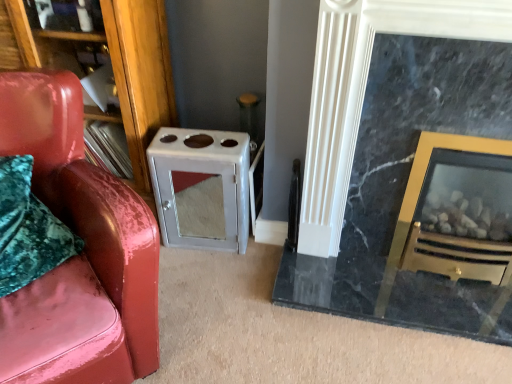
Question: Is glossy leather chair at left surrounding wooden bookshelf at left?

Choices:
 (A) yes
 (B) no

Answer: (B)

Question: From a real-world perspective, is glossy leather chair at left positioned under wooden bookshelf at left based on gravity?

Choices:
 (A) yes
 (B) no

Answer: (A)

Question: Is glossy leather chair at left to the left of wooden bookshelf at left from the viewer's perspective?

Choices:
 (A) yes
 (B) no

Answer: (B)

Question: From the image's perspective, is glossy leather chair at left located above wooden bookshelf at left?

Choices:
 (A) no
 (B) yes

Answer: (A)

Question: Does glossy leather chair at left have a lesser width compared to wooden bookshelf at left?

Choices:
 (A) no
 (B) yes

Answer: (A)

Question: Does glossy leather chair at left touch wooden bookshelf at left?

Choices:
 (A) yes
 (B) no

Answer: (B)

Question: Is the depth of wooden bookshelf at left less than that of black marble fireplace at right?

Choices:
 (A) no
 (B) yes

Answer: (A)

Question: Would you consider wooden bookshelf at left to be distant from black marble fireplace at right?

Choices:
 (A) no
 (B) yes

Answer: (A)

Question: Is black marble fireplace at right at the back of wooden bookshelf at left?

Choices:
 (A) no
 (B) yes

Answer: (A)

Question: Is wooden bookshelf at left wider than black marble fireplace at right?

Choices:
 (A) yes
 (B) no

Answer: (A)

Question: From a real-world perspective, is wooden bookshelf at left below black marble fireplace at right?

Choices:
 (A) yes
 (B) no

Answer: (B)

Question: Is wooden bookshelf at left smaller than black marble fireplace at right?

Choices:
 (A) no
 (B) yes

Answer: (B)

Question: Considering the relative sizes of satin silver cabinet at center and glossy leather chair at left in the image provided, is satin silver cabinet at center thinner than glossy leather chair at left?

Choices:
 (A) yes
 (B) no

Answer: (A)